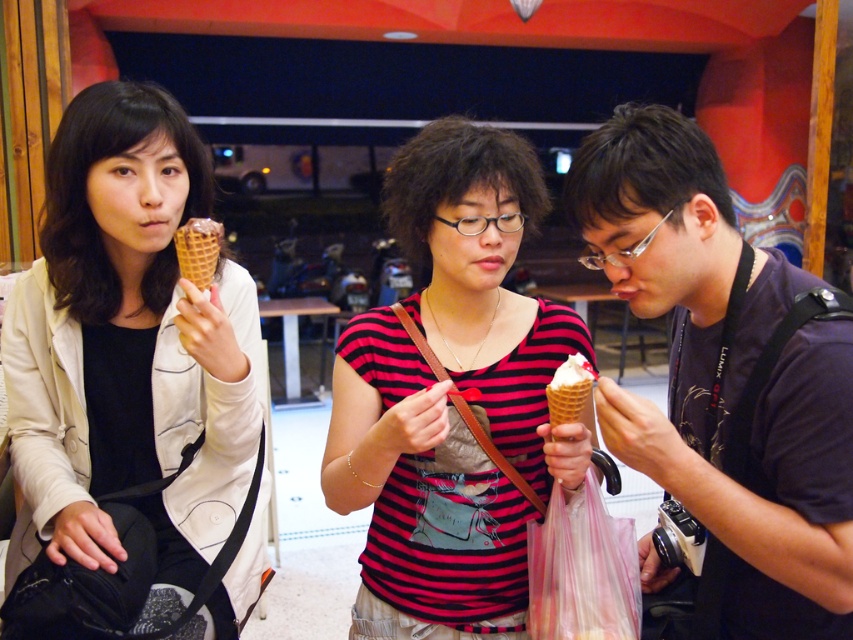
You are a photographer trying to capture a group photo of the matte black shirt at center and the white creamy ice cream at center. If you want to ensure both are fully visible in the frame, which object should you adjust the camera focus to prioritize based on their sizes?

The matte black shirt at center has a larger width than the white creamy ice cream at center. Therefore, you should prioritize focusing on the matte black shirt at center to ensure it is fully captured in the frame.

You are a delivery robot with a 50 cm wide tray. You need to place an order between the chocolate waffle cone at left and the white creamy ice cream at center. Can your tray fit between them without touching either?

The distance between the chocolate waffle cone at left and the white creamy ice cream at center is 52.76 centimeters. Since your tray is 50 cm wide, it can fit between them as the space is slightly larger than the tray.

You are a photographer standing at the entrance of the cafe. You want to take a portrait of the person wearing the matte black shirt at center and the white creamy ice cream at center. Can you fit both subjects in your camera frame if your camera has a minimum focus distance of 8 inches?

The matte black shirt at center is 7.97 inches away from the white creamy ice cream at center. Since the distance between them is less than the camera minimum focus distance of 8 inches, you can fit both subjects in your camera frame.